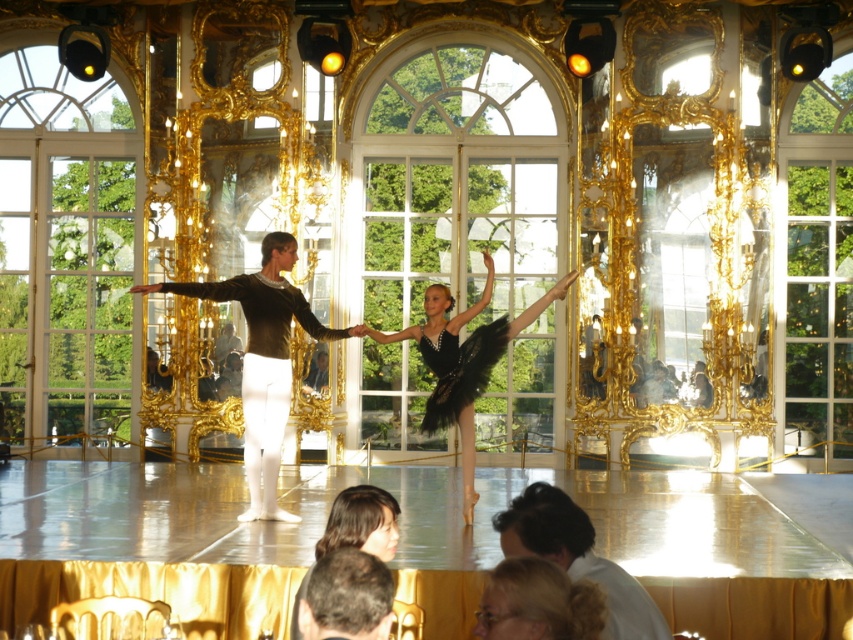
Question: Does black tulle skirt at center come in front of blonde hair at lower center?

Choices:
 (A) yes
 (B) no

Answer: (B)

Question: Based on their relative distances, which object is farther from the white shirt at center?

Choices:
 (A) black tulle skirt at center
 (B) brown hair at center

Answer: (A)

Question: Is black tulle skirt at center to the left of brown hair at center from the viewer's perspective?

Choices:
 (A) no
 (B) yes

Answer: (A)

Question: Which is farther from the white shirt at center?

Choices:
 (A) matte black leotard at center
 (B) brown hair at center
 (C) blonde hair at lower center

Answer: (A)

Question: From the image, what is the correct spatial relationship of black tulle skirt at center in relation to brown hair at center?

Choices:
 (A) right
 (B) left

Answer: (A)

Question: Among these objects, which one is farthest from the camera?

Choices:
 (A) brown hair at center
 (B) white shirt at center
 (C) blonde hair at lower center
 (D) matte black leotard at center

Answer: (D)